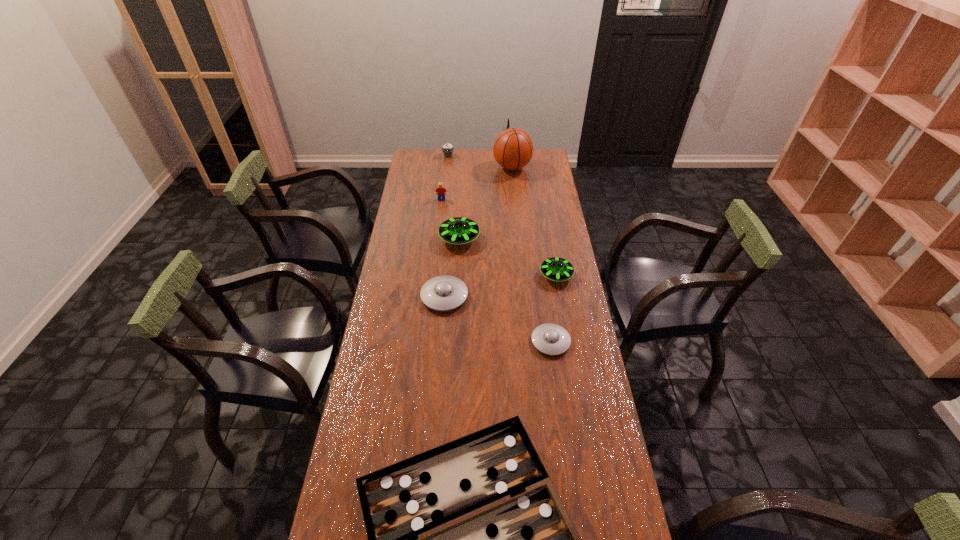
Select which saucer appears as the closest to the third farthest object. Please provide its 2D coordinates. Your answer should be formatted as a tuple, i.e. [(x, y)], where the tuple contains the x and y coordinates of a point satisfying the conditions above.

[(459, 230)]